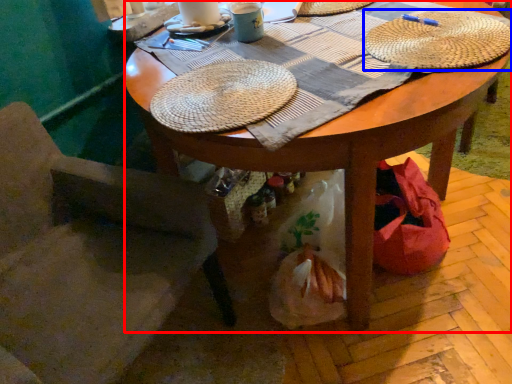
Question: Which object appears closest to the camera in this image, desk (highlighted by a red box) or hat (highlighted by a blue box)?

Choices:
 (A) desk
 (B) hat

Answer: (A)